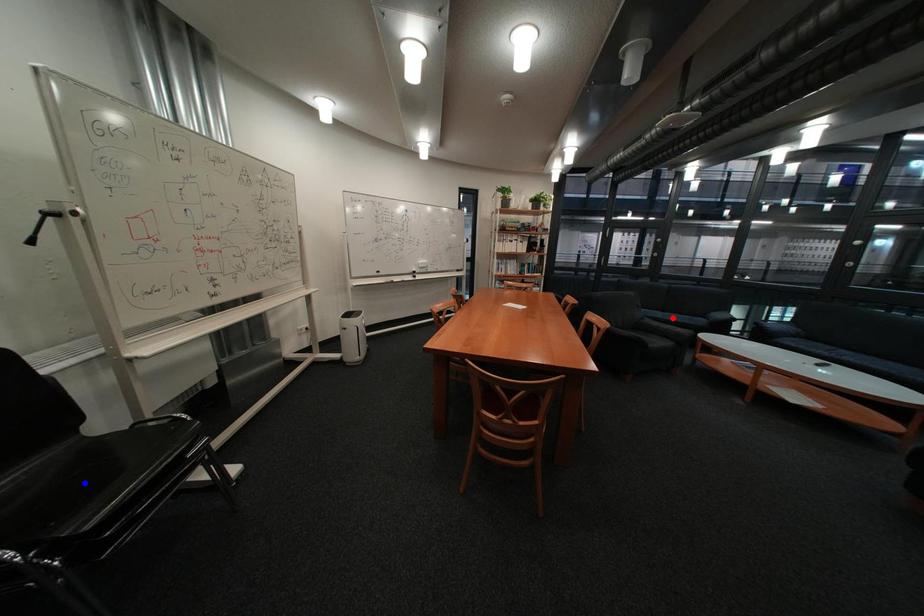
Question: In the image, two points are highlighted. Which point is nearer to the camera? Reply with the corresponding letter.

Choices:
 (A) blue point
 (B) red point

Answer: (A)